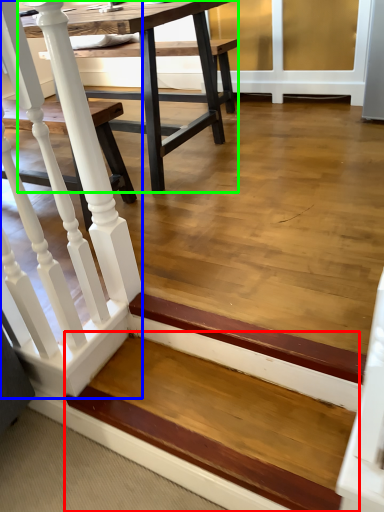
Question: Estimate the real-world distances between objects in this image. Which object is closer to stairwell (highlighted by a red box), rail (highlighted by a blue box) or table (highlighted by a green box)?

Choices:
 (A) rail
 (B) table

Answer: (A)